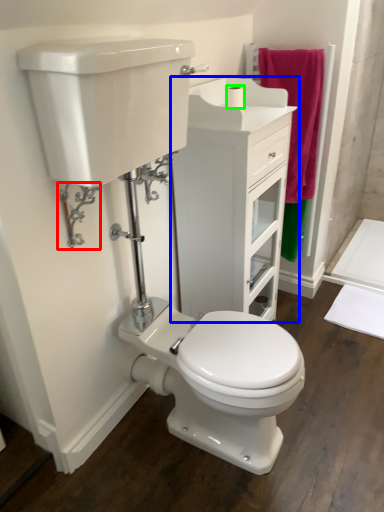
Question: Estimate the real-world distances between objects in this image. Which object is farther from plumbing fixture (highlighted by a red box), bathroom cabinet (highlighted by a blue box) or toilet paper (highlighted by a green box)?

Choices:
 (A) bathroom cabinet
 (B) toilet paper

Answer: (B)